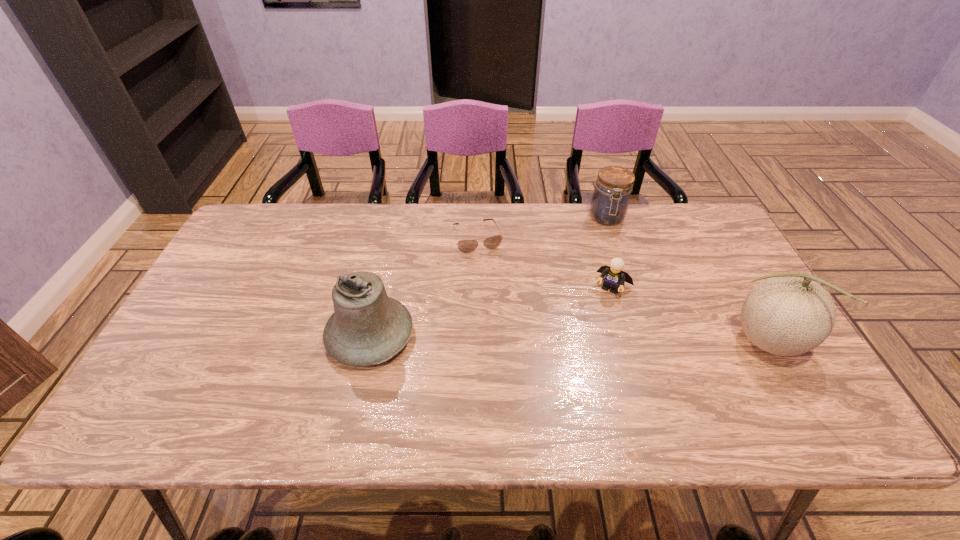
The height and width of the screenshot is (540, 960). In order to click on blank space located on the back of the tallest object in this screenshot , I will do `click(708, 239)`.

Identify the location of vacant space positioned 0.380m on the front-facing side of the shortest object. (516, 355).

What are the coordinates of `vacant region located 0.300m on the front-facing side of the shortest object` in the screenshot? It's located at point(508,329).

At what (x,y) coordinates should I click in order to perform the action: click on vacant position located 0.180m on the front-facing side of the shortest object. Please return your answer as a coordinate pair (x, y). The height and width of the screenshot is (540, 960). Looking at the image, I should click on (496, 296).

Identify the location of vacant space located 0.200m on the lid of the jar. (614, 273).

You are a GUI agent. You are given a task and a screenshot of the screen. Output one action in this format:
    pyautogui.click(x=<x>, y=<y>)
    Task: Click on the vacant space situated on the lid of the jar
    The height and width of the screenshot is (540, 960).
    Given the screenshot: What is the action you would take?
    pyautogui.click(x=620, y=321)

This screenshot has width=960, height=540. Find the location of `free space located on the lid of the jar`. free space located on the lid of the jar is located at coordinates (614, 278).

I want to click on vacant area located 0.200m on the front-facing side of the Lego, so click(x=580, y=349).

Find the location of a particular element. vacant point located on the front-facing side of the Lego is located at coordinates (564, 379).

Locate an element on the screen. This screenshot has width=960, height=540. free spot located 0.260m on the front-facing side of the Lego is located at coordinates click(570, 367).